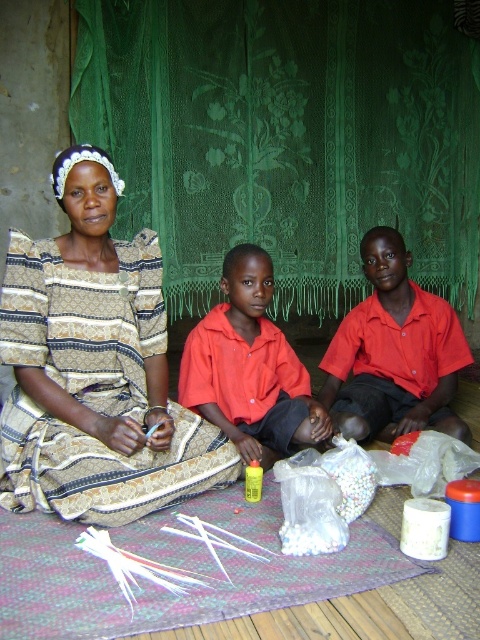
Question: Is the position of patterned fabric dress at left more distant than that of red matte shirt at center?

Choices:
 (A) yes
 (B) no

Answer: (B)

Question: In this image, where is matte red shirt at center located relative to red matte shirt at center?

Choices:
 (A) right
 (B) left

Answer: (A)

Question: Which is farther from the patterned fabric dress at left?

Choices:
 (A) matte red shirt at center
 (B) red matte shirt at center

Answer: (A)

Question: Based on their relative distances, which object is nearer to the red matte shirt at center?

Choices:
 (A) matte red shirt at center
 (B) patterned fabric dress at left

Answer: (B)

Question: Can you confirm if patterned fabric dress at left is smaller than matte red shirt at center?

Choices:
 (A) no
 (B) yes

Answer: (A)

Question: Which point appears closest to the camera in this image?

Choices:
 (A) (251, 268)
 (B) (384, 346)

Answer: (A)